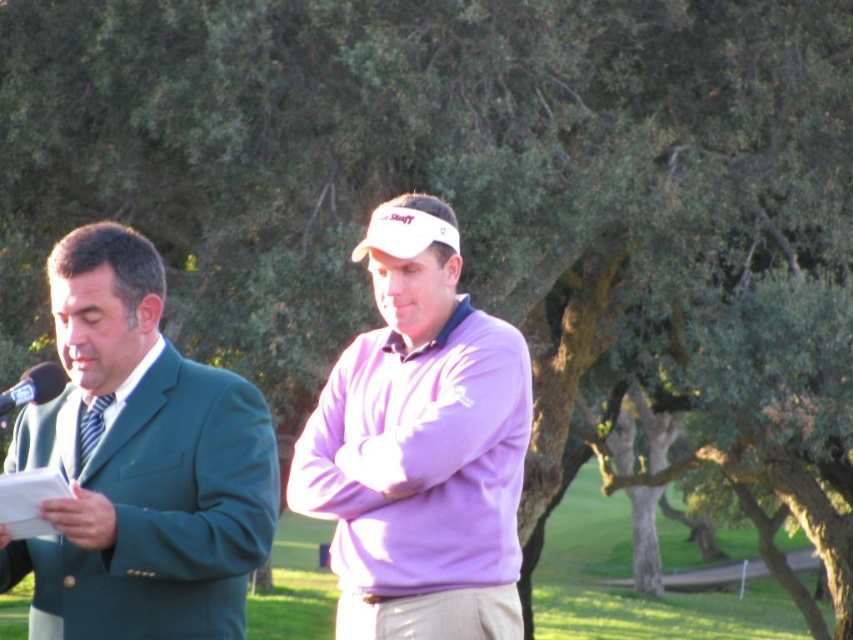
You are standing at the edge of the golf course and want to place a small decorative rock exactly where the green grass at center is located. According to the coordinates provided, where should you place the rock?

The green grass at center is located at point (630, 584), so you should place the rock at those coordinates.

You are a photographer at the golf course event. You need to capture a photo of both the green suit at left and the striped fabric tie at left. Which object should you adjust your camera focus to first to ensure both are in frame?

The striped fabric tie at left is to the left of the green suit at left. Since the striped fabric tie is closer to the left edge of the frame, you should focus on it first to ensure it stays within the camera view while adjusting for the green suit at left.

You are a photographer at a golf course event and need to frame a shot that includes both the green suit at left and the black plastic microphone at left. Which object should you adjust your focus on first if you want to ensure the thinner object is in sharp focus?

The green suit at left is thinner than the black plastic microphone at left, so you should focus on the green suit at left first to ensure its details are clear.